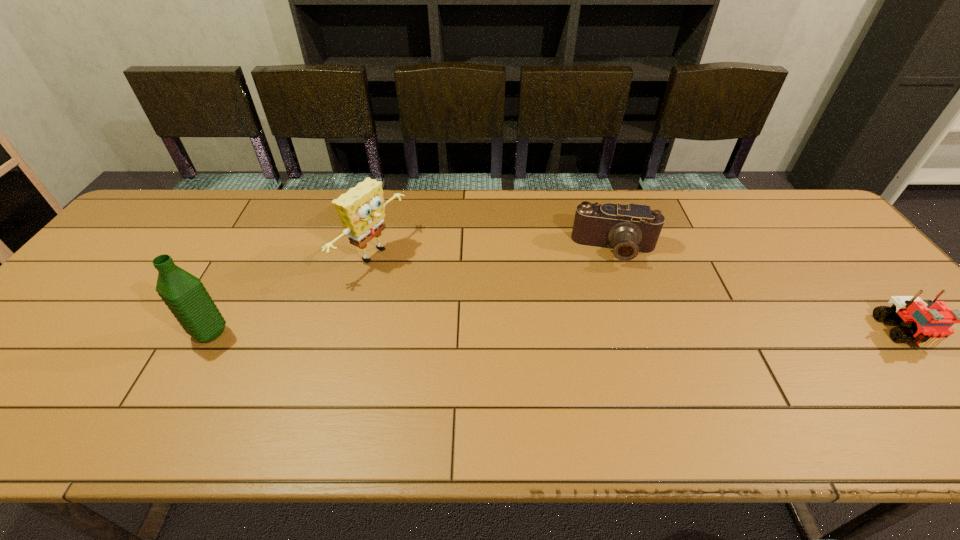
Where is `free space that is in between the second object from left to right and the Lego`? free space that is in between the second object from left to right and the Lego is located at coordinates (639, 293).

Where is `free area in between the leftmost object and the rightmost object`? The image size is (960, 540). free area in between the leftmost object and the rightmost object is located at coordinates (558, 333).

Find the location of `free point between the rightmost object and the second object from left to right`. free point between the rightmost object and the second object from left to right is located at coordinates (639, 293).

Where is `free point between the water bottle and the rightmost object`? The width and height of the screenshot is (960, 540). free point between the water bottle and the rightmost object is located at coordinates (558, 333).

I want to click on vacant area that lies between the second object from right to left and the water bottle, so click(x=413, y=291).

At what (x,y) coordinates should I click in order to perform the action: click on vacant area between the Lego and the water bottle. Please return your answer as a coordinate pair (x, y). Looking at the image, I should click on (558, 333).

Image resolution: width=960 pixels, height=540 pixels. In order to click on vacant area that lies between the camera and the rightmost object in this screenshot , I will do `click(759, 291)`.

At what (x,y) coordinates should I click in order to perform the action: click on free space between the sponge and the second object from right to left. Please return your answer as a coordinate pair (x, y). This screenshot has width=960, height=540. Looking at the image, I should click on (494, 252).

In order to click on free space between the leftmost object and the second object from left to right in this screenshot , I will do `click(292, 294)`.

Identify which object is the closest to the water bottle. Please provide its 2D coordinates. Your answer should be formatted as a tuple, i.e. [(x, y)], where the tuple contains the x and y coordinates of a point satisfying the conditions above.

[(361, 209)]